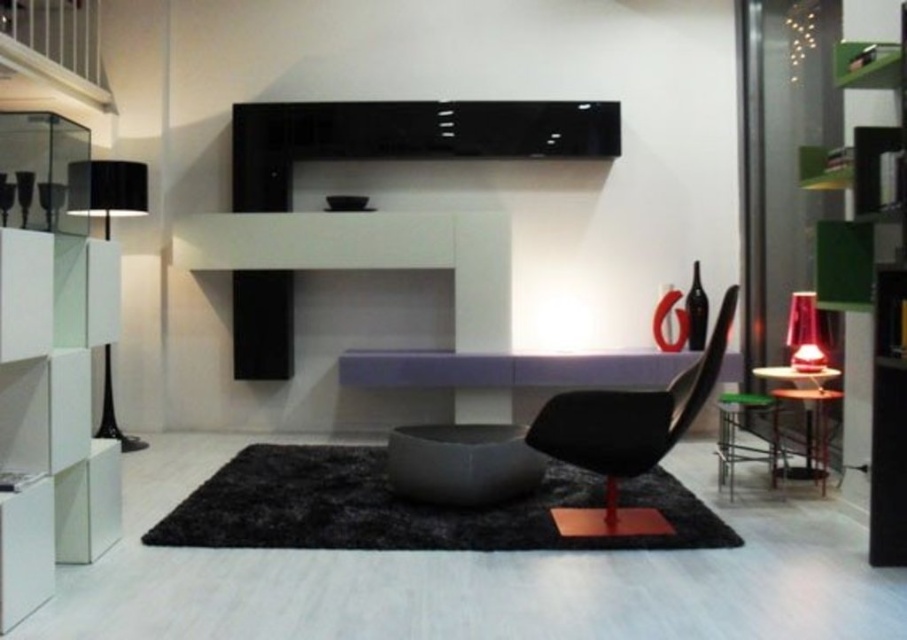
Is green matte bookshelf at right taller than black matte armchair at center?

Yes, green matte bookshelf at right is taller than black matte armchair at center.

Does point (885, 298) come farther from viewer compared to point (567, 524)?

No, it is in front of (567, 524).

This screenshot has width=907, height=640. I want to click on green matte bookshelf at right, so click(x=875, y=284).

Is black matte floor lamp at left taller than translucent red glass lampshade at right?

Correct, black matte floor lamp at left is much taller as translucent red glass lampshade at right.

Does black matte floor lamp at left have a greater width compared to translucent red glass lampshade at right?

Correct, the width of black matte floor lamp at left exceeds that of translucent red glass lampshade at right.

I want to click on black matte floor lamp at left, so click(x=106, y=189).

Locate an element on the screen. The width and height of the screenshot is (907, 640). black matte floor lamp at left is located at coordinates (106, 189).

Consider the image. Does translucent red glass lampshade at right appear on the right side of metallic black side table at lower right?

Indeed, translucent red glass lampshade at right is positioned on the right side of metallic black side table at lower right.

Is translucent red glass lampshade at right wider than metallic black side table at lower right?

No.

In the scene shown: Who is more forward, (800,346) or (808,388)?

Point (808,388) is in front.

Where is `translucent red glass lampshade at right`? This screenshot has width=907, height=640. translucent red glass lampshade at right is located at coordinates (805, 333).